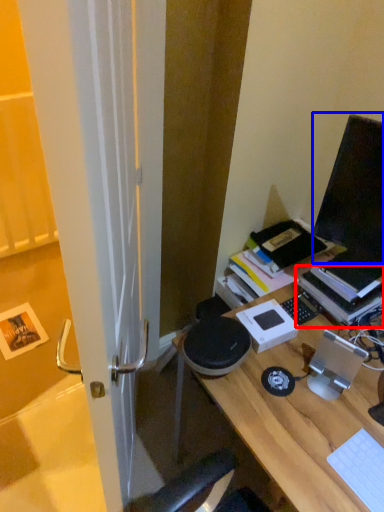
Question: Among these objects, which one is nearest to the camera, paperback book (highlighted by a red box) or computer monitor (highlighted by a blue box)?

Choices:
 (A) paperback book
 (B) computer monitor

Answer: (B)